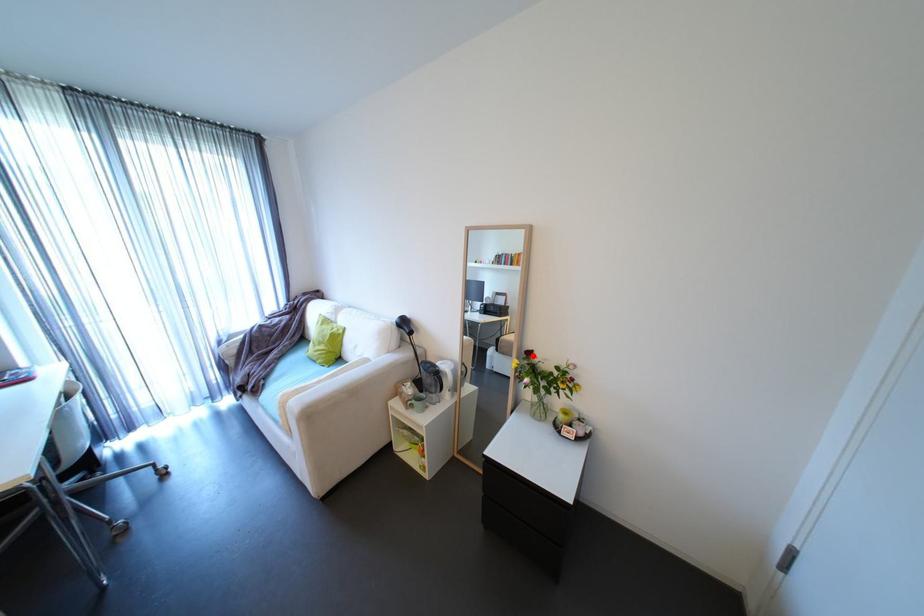
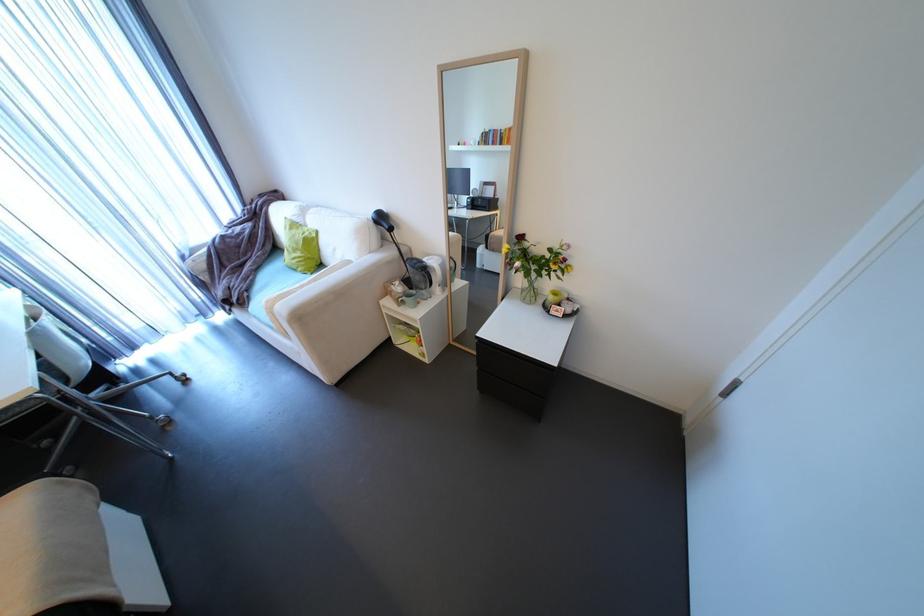
Question: I am providing you with two images of the same scene from different viewpoints. A red point is shown in image1. For the corresponding object point in image2, is it positioned nearer or farther from the camera?

Choices:
 (A) Nearer
 (B) Farther

Answer: (A)